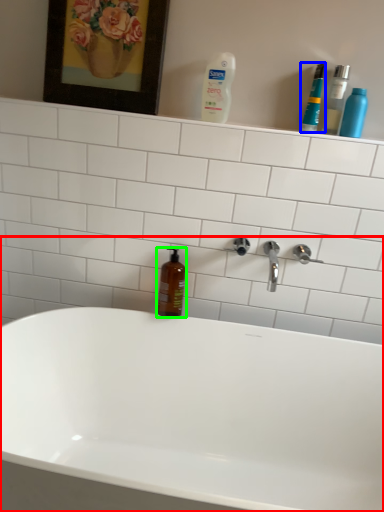
Question: Which is nearer to the bathtub (highlighted by a red box)? mouthwash (highlighted by a blue box) or mouthwash (highlighted by a green box).

Choices:
 (A) mouthwash
 (B) mouthwash

Answer: (B)